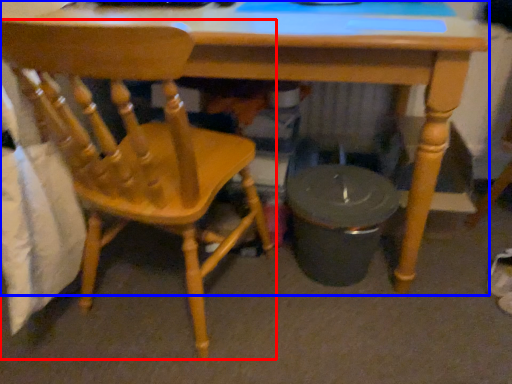
Question: Which object appears closest to the camera in this image, chair (highlighted by a red box) or desk (highlighted by a blue box)?

Choices:
 (A) chair
 (B) desk

Answer: (A)